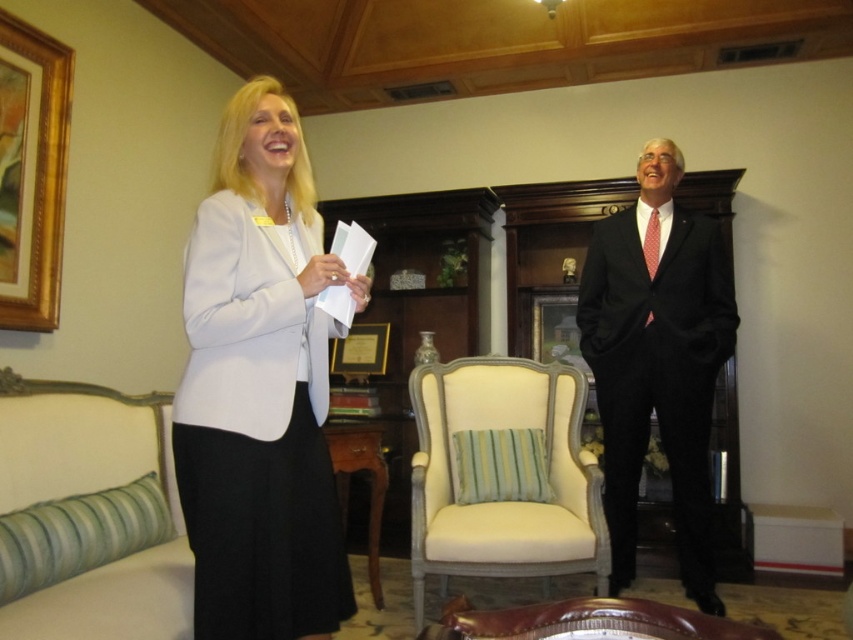
Does white matte blazer at center have a lesser width compared to gold-framed painting at upper left?

Incorrect, white matte blazer at center's width is not less than gold-framed painting at upper left's.

Measure the distance between white matte blazer at center and camera.

1.50 meters

What are the coordinates of `white matte blazer at center` in the screenshot? It's located at (260, 387).

Locate an element on the screen. The height and width of the screenshot is (640, 853). white matte blazer at center is located at coordinates (260, 387).

Can you confirm if gold-framed painting at upper left is thinner than leather armchair at center?

Yes, gold-framed painting at upper left is thinner than leather armchair at center.

Measure the distance between point [15,285] and camera.

They are 2.67 meters apart.

What do you see at coordinates (32, 172) in the screenshot? Image resolution: width=853 pixels, height=640 pixels. I see `gold-framed painting at upper left` at bounding box center [32, 172].

Find the location of a particular element. gold-framed painting at upper left is located at coordinates (32, 172).

Can you confirm if cream fabric armchair at center is positioned to the left of gold-framed painting at upper left?

In fact, cream fabric armchair at center is to the right of gold-framed painting at upper left.

Is point (433, 560) in front of point (3, 307)?

Yes, it is.

Find the location of a particular element. Image resolution: width=853 pixels, height=640 pixels. cream fabric armchair at center is located at coordinates (502, 474).